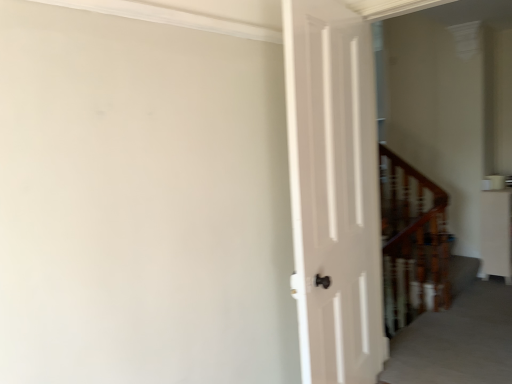
Question: Which is correct: white glossy cabinet at right is inside wooden staircase at right, or outside of it?

Choices:
 (A) outside
 (B) inside

Answer: (A)

Question: In terms of width, does white glossy cabinet at right look wider or thinner when compared to wooden staircase at right?

Choices:
 (A) thin
 (B) wide

Answer: (A)

Question: In the image, is white glossy cabinet at right positioned in front of or behind wooden staircase at right?

Choices:
 (A) behind
 (B) front

Answer: (A)

Question: Would you say wooden staircase at right is inside or outside white glossy cabinet at right?

Choices:
 (A) inside
 (B) outside

Answer: (B)

Question: Is wooden staircase at right to the left or to the right of white glossy cabinet at right in the image?

Choices:
 (A) left
 (B) right

Answer: (A)

Question: Looking at the image, does wooden staircase at right seem bigger or smaller compared to white glossy cabinet at right?

Choices:
 (A) small
 (B) big

Answer: (A)

Question: Considering the positions of wooden staircase at right and white glossy cabinet at right in the image, is wooden staircase at right taller or shorter than white glossy cabinet at right?

Choices:
 (A) tall
 (B) short

Answer: (A)